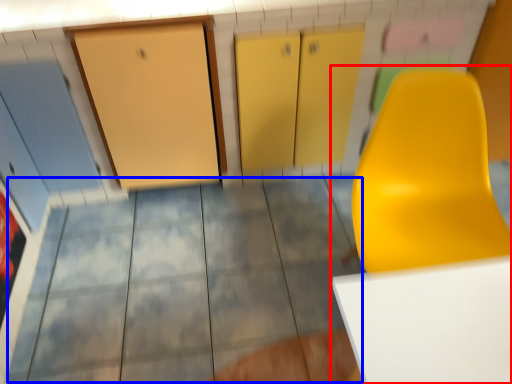
Question: Which object is closer to the camera taking this photo, furniture (highlighted by a red box) or tile (highlighted by a blue box)?

Choices:
 (A) furniture
 (B) tile

Answer: (A)